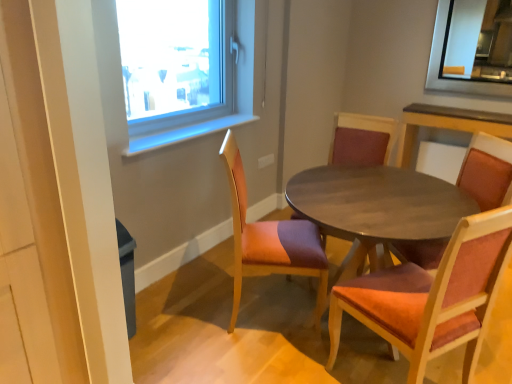
The width and height of the screenshot is (512, 384). What are the coordinates of `free spot to the left of wooden textured chair at center, placed as the 4th chair when sorted from right to left` in the screenshot? It's located at (184, 310).